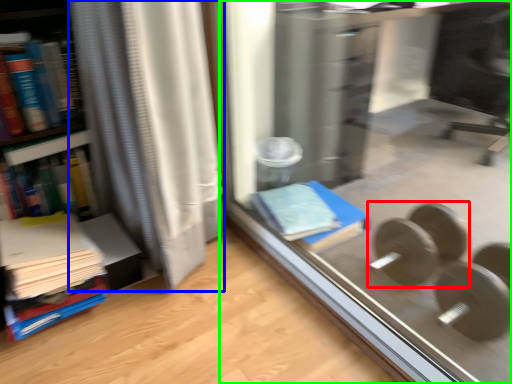
Question: Estimate the real-world distances between objects in this image. Which object is closer to dumbbell (highlighted by a red box), curtain (highlighted by a blue box) or glass door (highlighted by a green box)?

Choices:
 (A) curtain
 (B) glass door

Answer: (B)